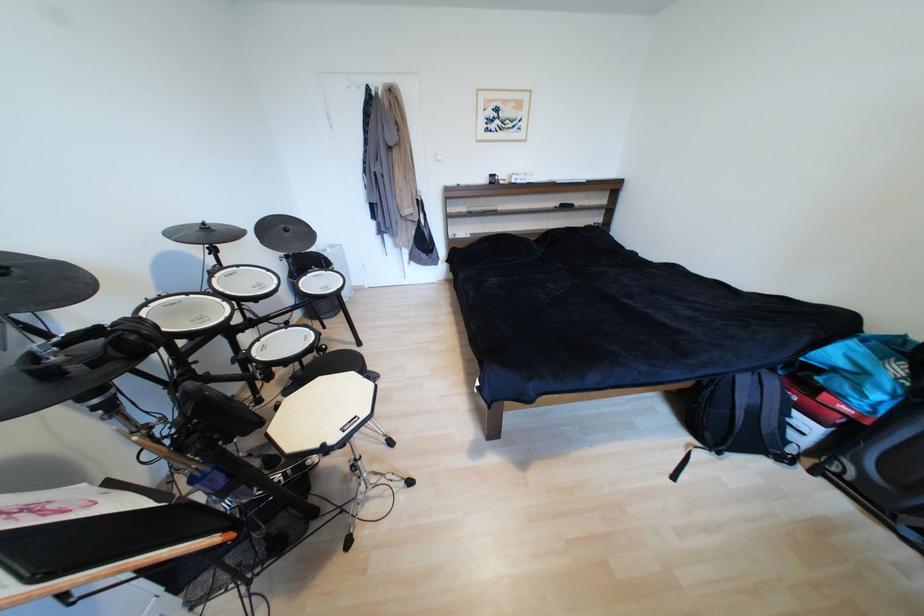
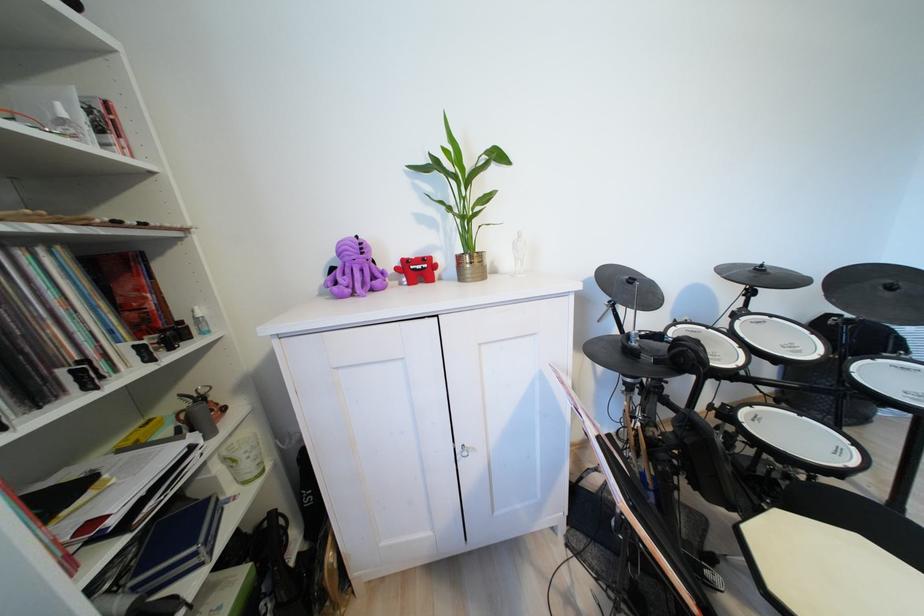
In the second image, find the point that corresponds to (x=293, y=231) in the first image.

(897, 289)